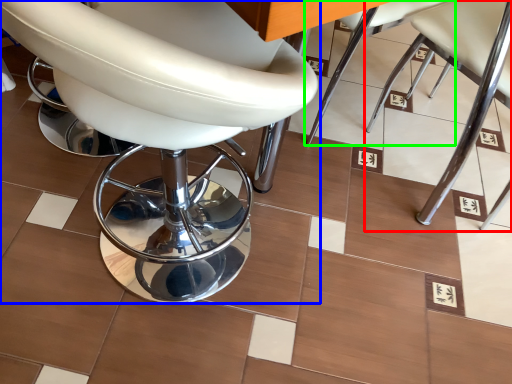
Question: Which object is positioned farthest from chair (highlighted by a red box)? Select from chair (highlighted by a blue box) and chair (highlighted by a green box).

Choices:
 (A) chair
 (B) chair

Answer: (A)